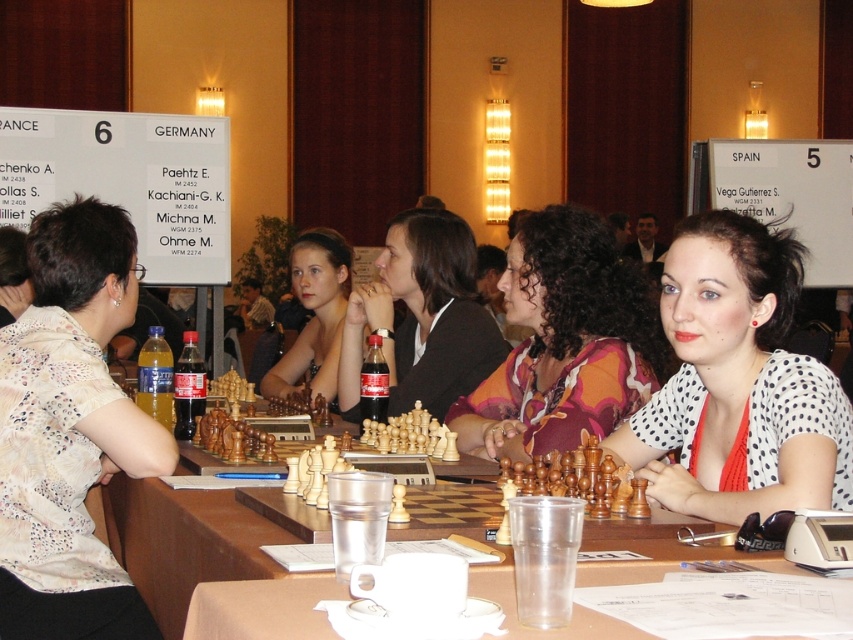
Question: Can you confirm if white dotted shirt at center is positioned to the right of matte black chess pieces at center?

Choices:
 (A) no
 (B) yes

Answer: (B)

Question: Which is nearer to the printed fabric shirt at center?

Choices:
 (A) white dotted shirt at left
 (B) white dotted shirt at center
 (C) matte black chess pieces at center
 (D) matte black jacket at center

Answer: (D)

Question: Observing the image, what is the correct spatial positioning of white dotted shirt at left in reference to wooden chess set at center?

Choices:
 (A) above
 (B) below

Answer: (A)

Question: Which point is closer to the camera?

Choices:
 (A) matte black chess pieces at center
 (B) wooden chess set at center
 (C) white dotted shirt at left
 (D) printed fabric shirt at center

Answer: (B)

Question: Which is nearer to the white dotted shirt at left?

Choices:
 (A) wooden chess set at center
 (B) matte black chess pieces at center

Answer: (A)

Question: Is matte black jacket at center bigger than matte black chess pieces at center?

Choices:
 (A) no
 (B) yes

Answer: (A)